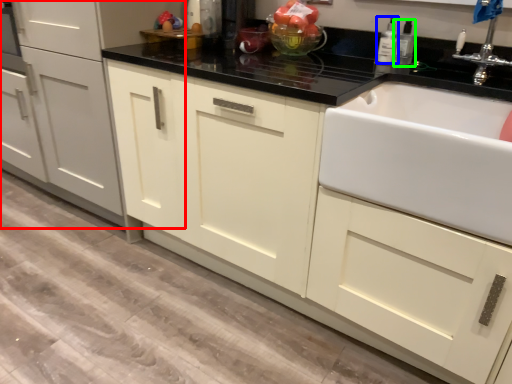
Question: Based on their relative distances, which object is farther from cabinetry (highlighted by a red box)? Choose from bottle (highlighted by a blue box) and bottle (highlighted by a green box).

Choices:
 (A) bottle
 (B) bottle

Answer: (B)